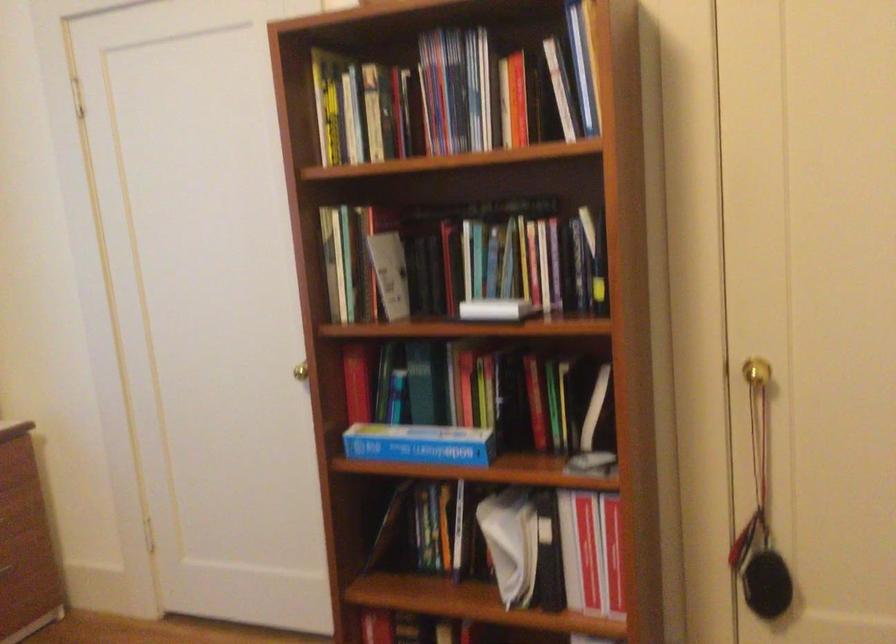
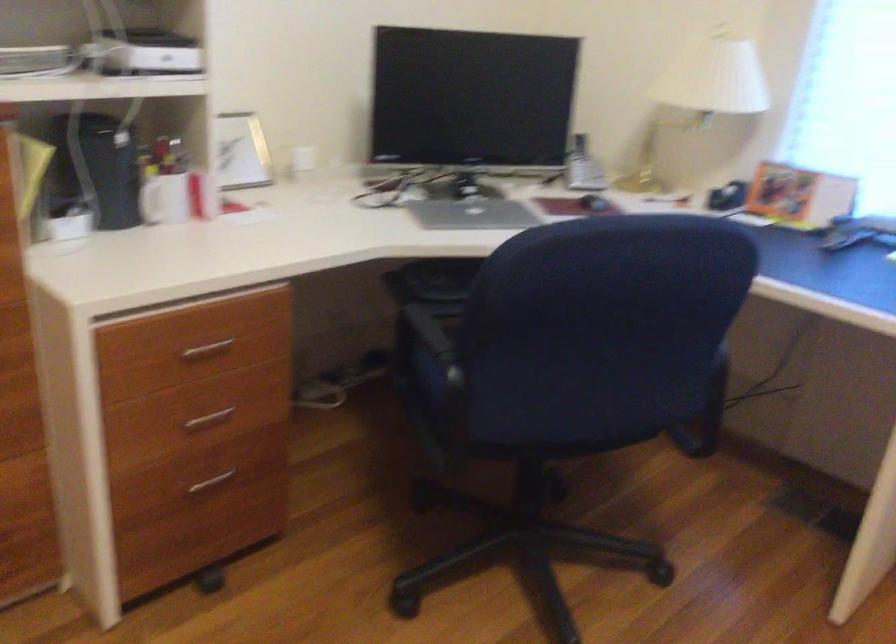
The images are taken continuously from a first-person perspective. In which direction is your viewpoint rotating?

The camera's rotation is toward left-down.